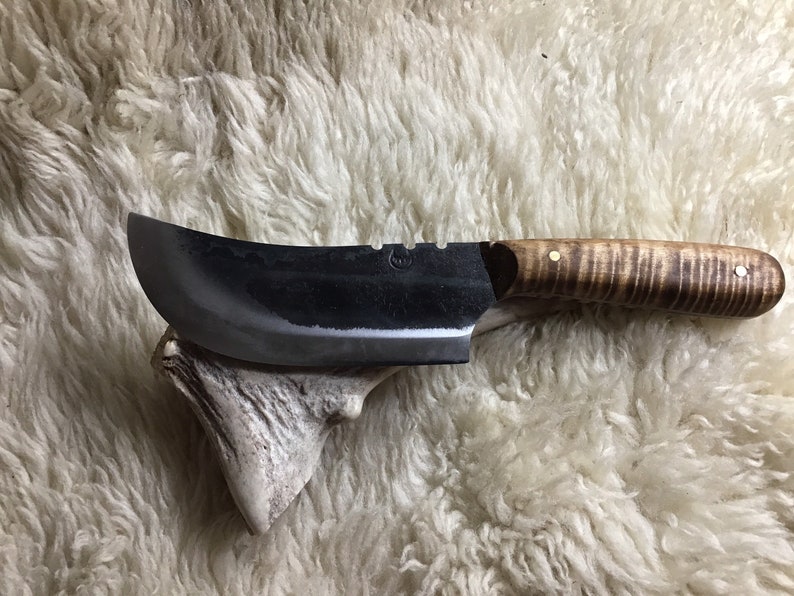
Identify the location of handle. The height and width of the screenshot is (596, 794). (507, 144), (640, 274).